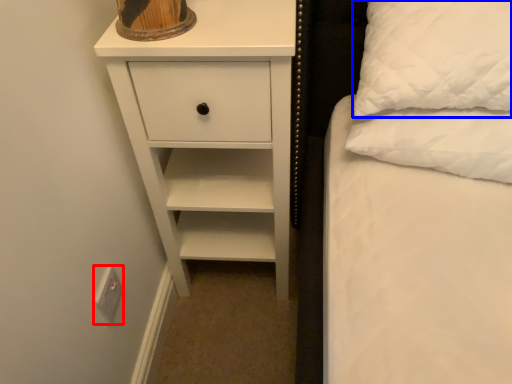
Question: Which of the following is the farthest to the observer, electric outlet (highlighted by a red box) or pillow (highlighted by a blue box)?

Choices:
 (A) electric outlet
 (B) pillow

Answer: (A)